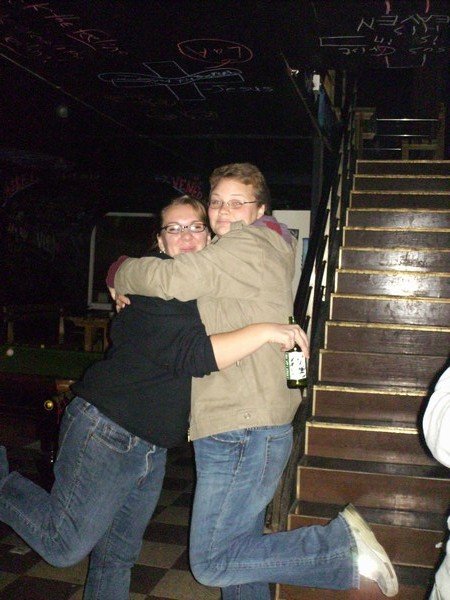
The height and width of the screenshot is (600, 450). What are the coordinates of `checkered floor` in the screenshot? It's located at (170, 566).